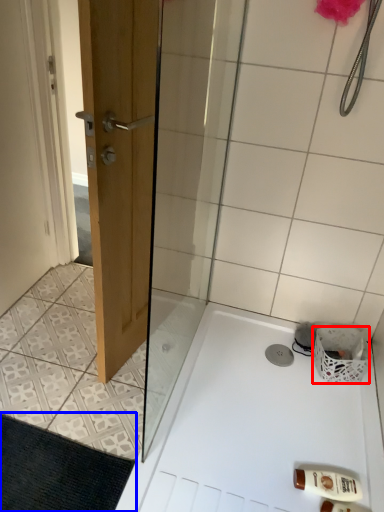
Question: Among these objects, which one is farthest to the camera, basket (highlighted by a red box) or bath mat (highlighted by a blue box)?

Choices:
 (A) basket
 (B) bath mat

Answer: (A)